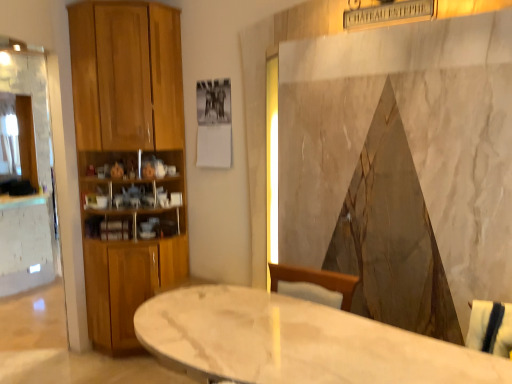
Image resolution: width=512 pixels, height=384 pixels. Find the location of `free space above white marble table at center (from a real-world perspective)`. free space above white marble table at center (from a real-world perspective) is located at coordinates (281, 332).